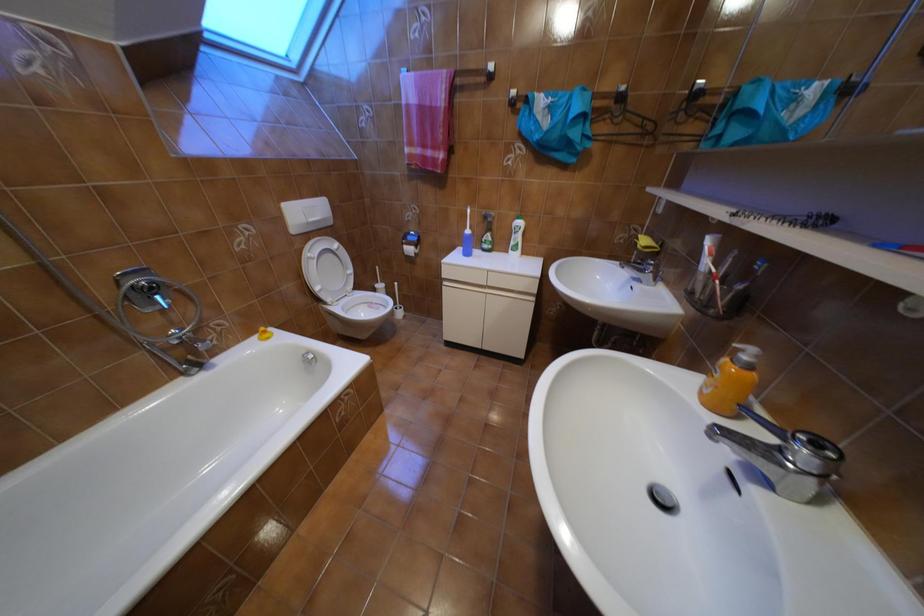
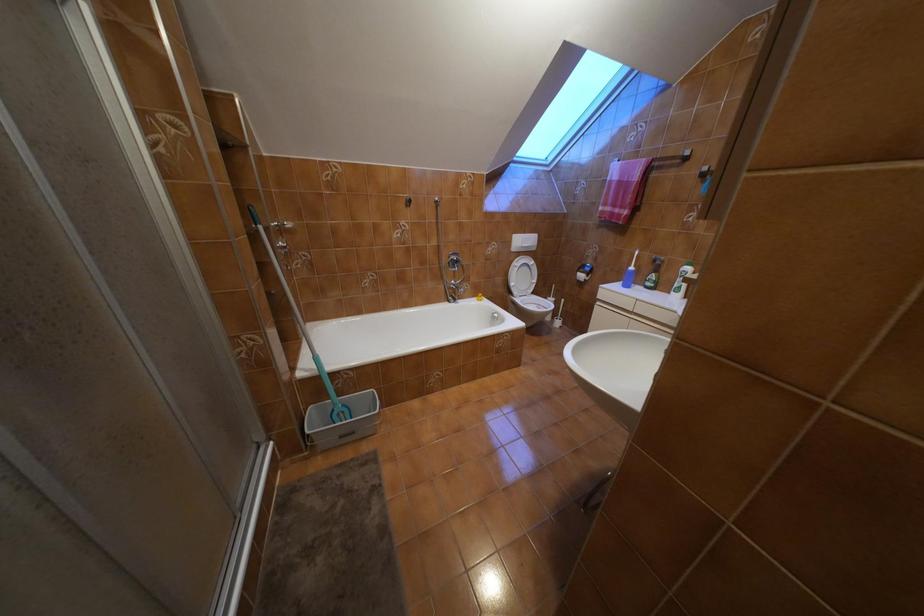
Question: The camera is either moving clockwise (left) or counter-clockwise (right) around the object. The first image is from the beginning of the video and the second image is from the end. Is the camera moving left or right when shooting the video?

Choices:
 (A) Left
 (B) Right

Answer: (B)